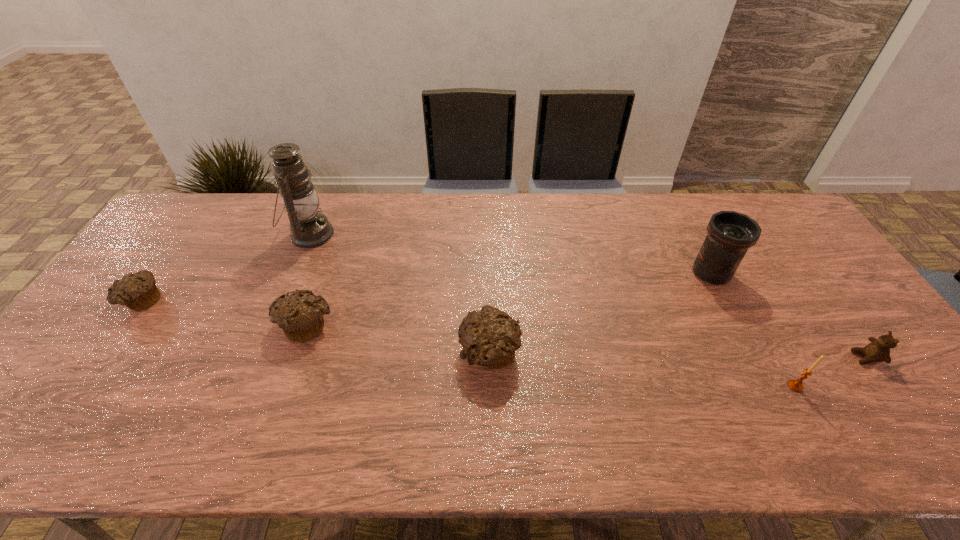
At what (x,y) coordinates should I click in order to perform the action: click on free space for a new muffin on the right. Please return your answer as a coordinate pair (x, y). Looking at the image, I should click on (693, 383).